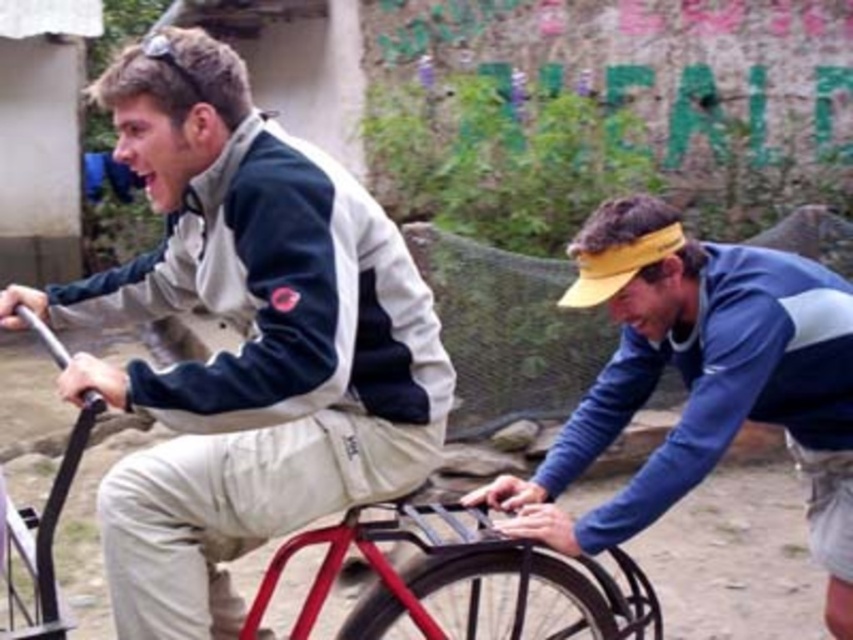
You are a photographer trying to capture a clear photo of both the matte white jacket at center and the black rubber tire at lower center. Since the camera can only focus on one object at a time, which object should you choose to ensure the larger one is in focus?

The matte white jacket at center is bigger than the black rubber tire at lower center, so you should focus on the matte white jacket at center to ensure the larger object is in focus.

You are a photographer trying to capture a photo of the matte white jacket at center and the black rubber wheel at lower right. Which object should you focus on first if you want to ensure both are in focus, given that the depth of field can only cover objects within a 10 cm height difference?

The matte white jacket at center is taller than the black rubber wheel at lower right, so you should focus on the matte white jacket at center first to ensure both are within the 10 cm depth of field range.